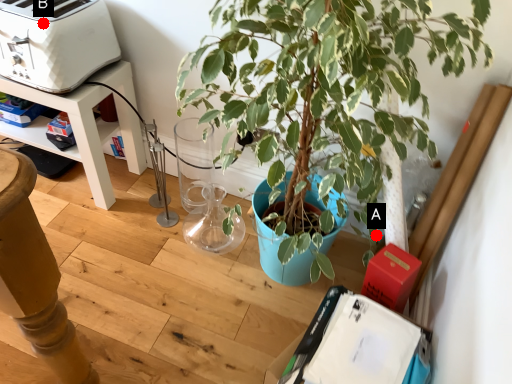
Question: Two points are circled on the image, labeled by A and B beside each circle. Which point appears closest to the camera in this image?

Choices:
 (A) A is closer
 (B) B is closer

Answer: (B)